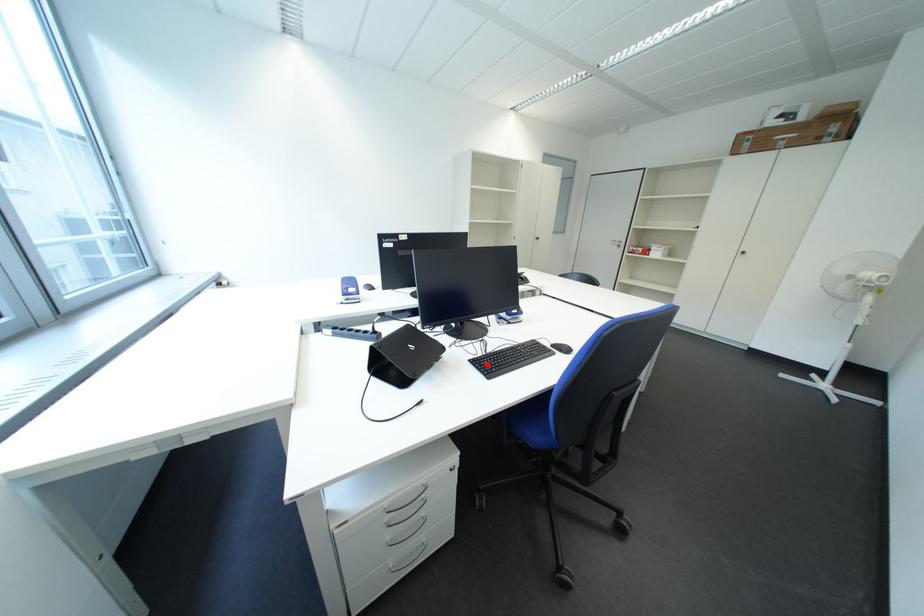
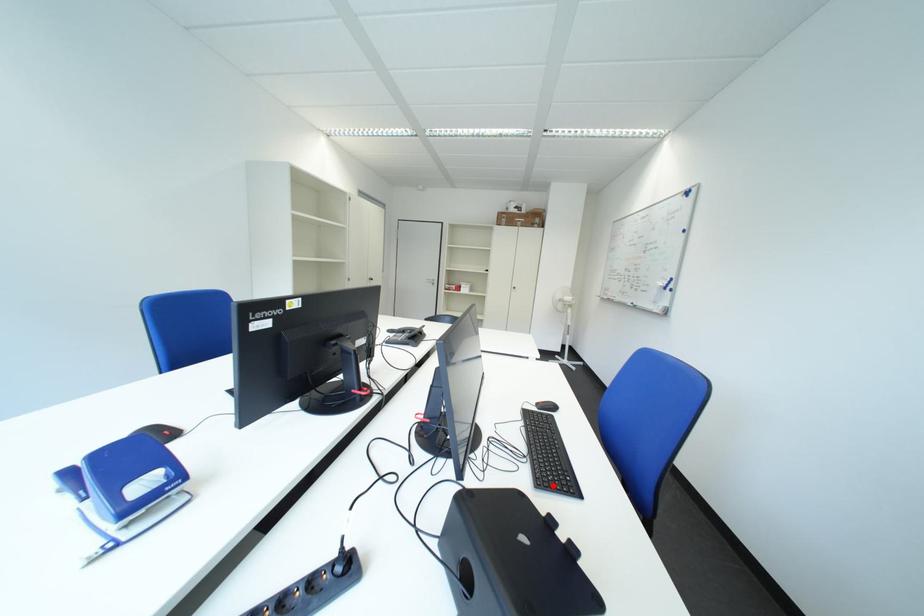
I am providing you with two images of the same scene from different viewpoints. A red point is marked on the first image and another point is marked on the second image. Is the marked point in image1 the same physical position as the marked point in image2?

Yes